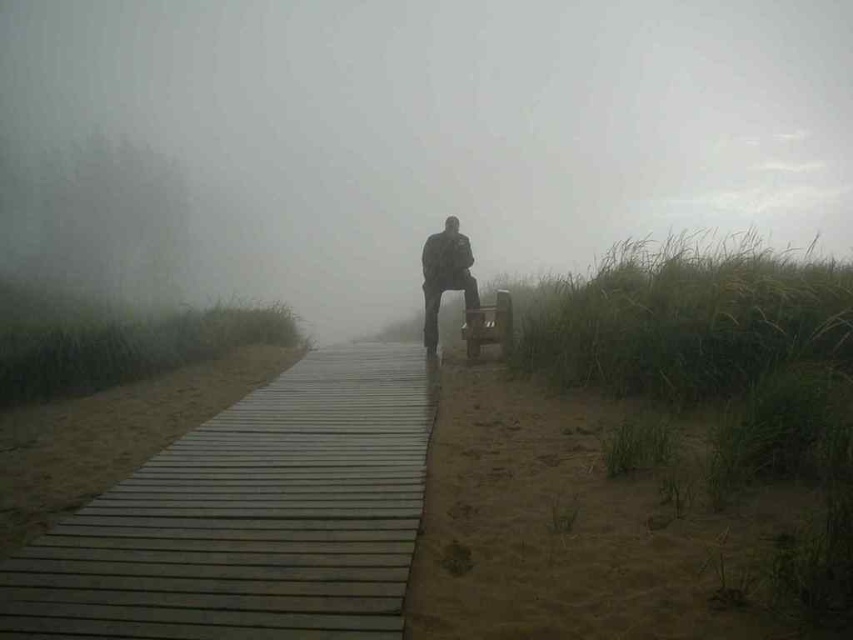
You are a hiker who just arrived at the boardwalk and see the foggy atmosphere at center and the dark gray fabric jacket at center. Which object is covering the other?

The foggy atmosphere at center is positioned over dark gray fabric jacket at center, so it is covering the jacket.